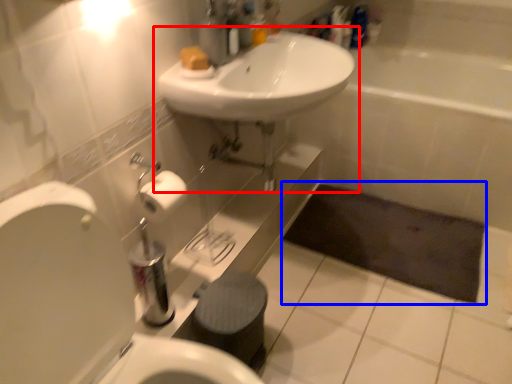
Question: Among these objects, which one is nearest to the camera, sink (highlighted by a red box) or bath mat (highlighted by a blue box)?

Choices:
 (A) sink
 (B) bath mat

Answer: (A)